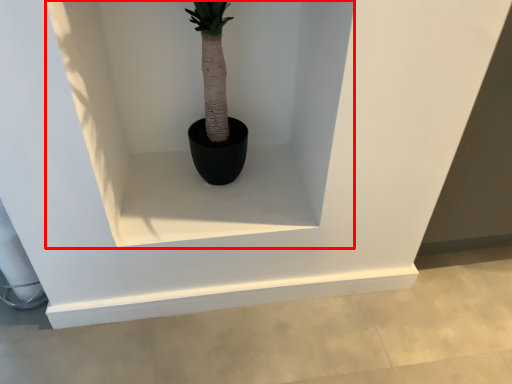
Question: In this image, where is shelf (annotated by the red box) located relative to window sill?

Choices:
 (A) left
 (B) right

Answer: (B)